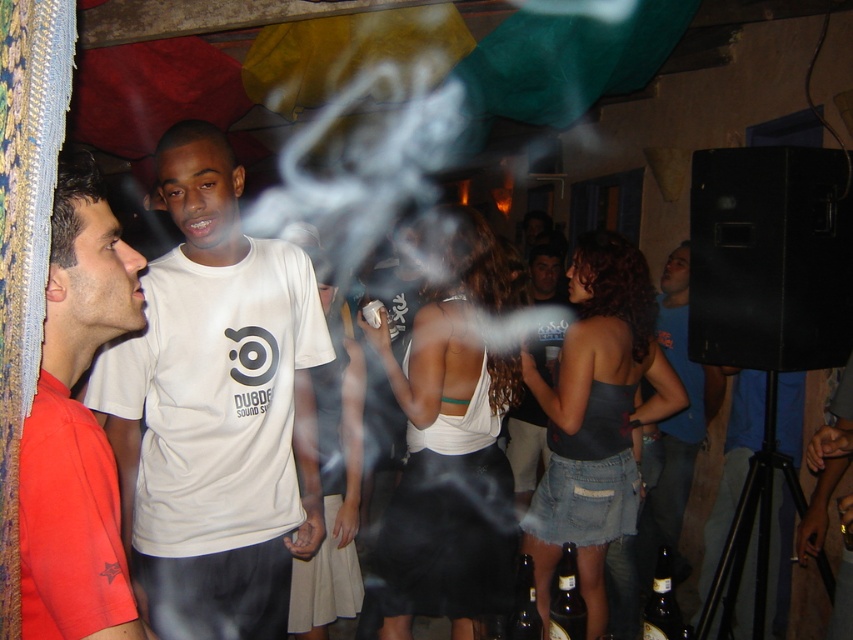
You are at a party and want to move from the point at the bottom left corner to the exit located at the point at the bottom right corner. There is a group of people standing at point [549,276] and another group at point [671,625]. Which group is closer to your starting position?

The group at point [671,625] is closer to your starting position because it is in front of the group at point [549,276], which is behind it.

In the scene shown: You are standing at the center of the room and want to locate the matte red shirt at left. In which direction should you look to find it?

You should look to the left to find the matte red shirt at left since it is positioned at the left side of the scene.